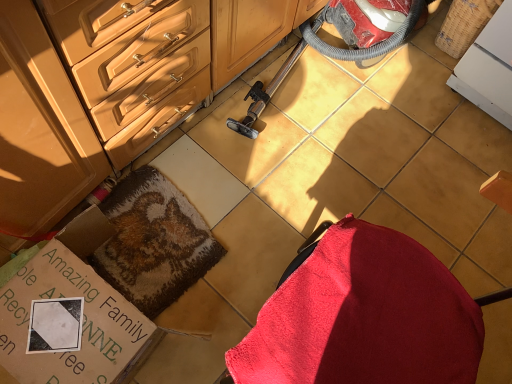
You are a GUI agent. You are given a task and a screenshot of the screen. Output one action in this format:
    pyautogui.click(x=<x>, y=<y>)
    Task: Click on the vacant space in between velvet red swivel chair at center and red plastic vacuum cleaner at center
    The height and width of the screenshot is (384, 512).
    Given the screenshot: What is the action you would take?
    pyautogui.click(x=342, y=189)